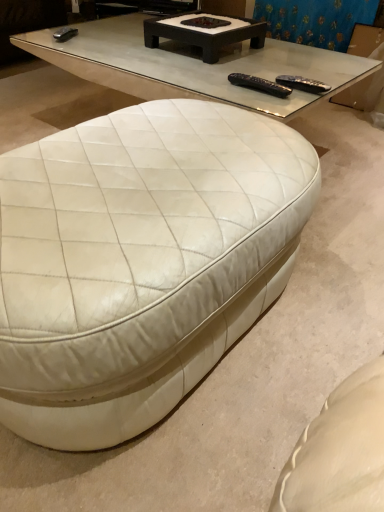
Locate an element on the screen. vacant region above white leather ottoman at lower left, placed as the 2th coffee table when sorted from back to front (from a real-world perspective) is located at coordinates (144, 170).